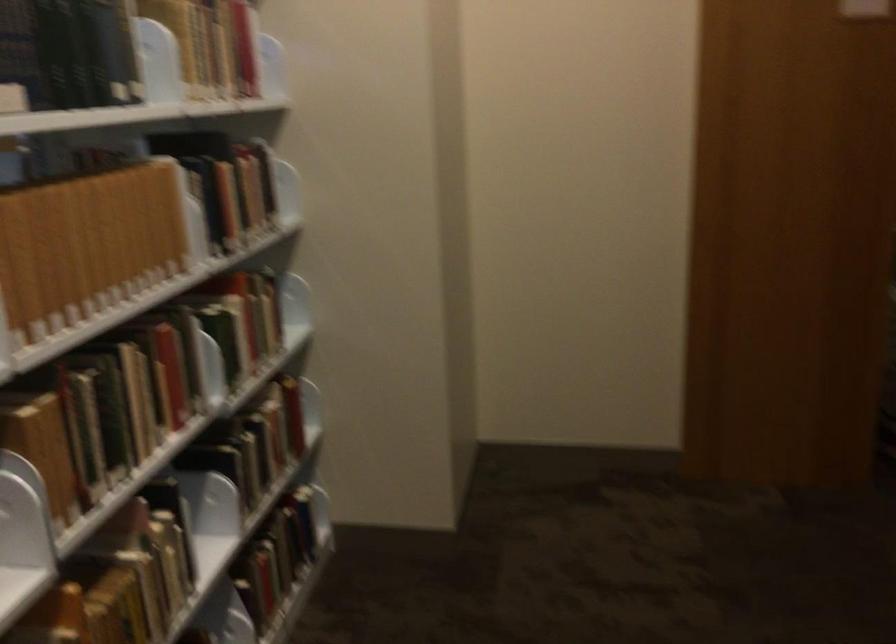
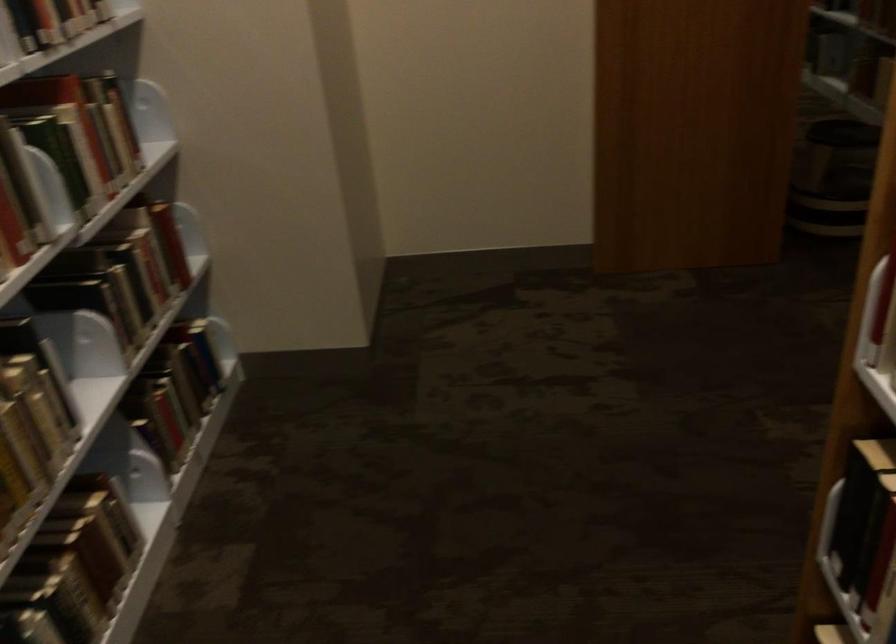
Question: What movement of the cameraman would produce the second image?

Choices:
 (A) Left
 (B) Right
 (C) Forward
 (D) Backward

Answer: (C)